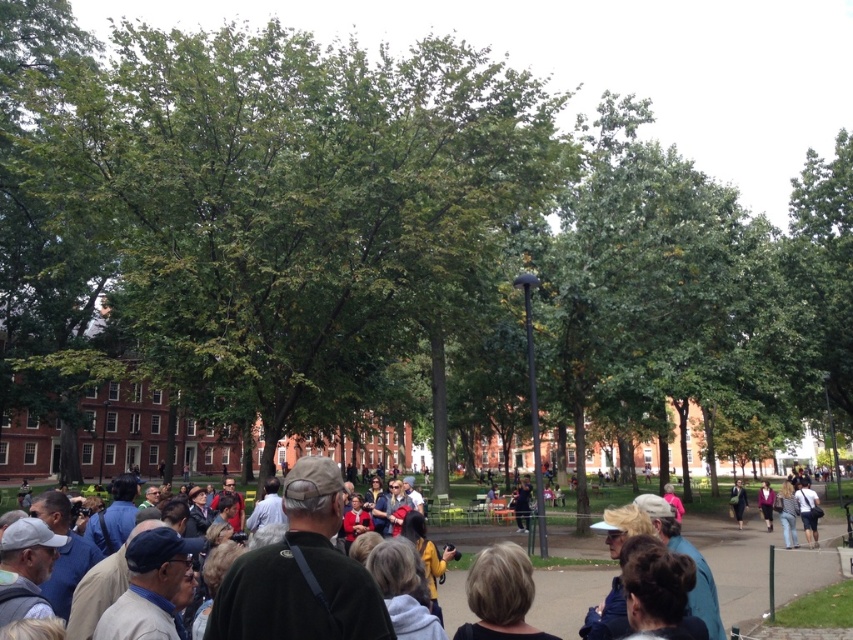
You are a photographer trying to capture a candid shot of the crowd. You notice a person with blonde hair at center and another wearing a dark blue jacket at center. Which of these two subjects is closer to the camera based on their positions?

The blonde hair at center is positioned over the dark blue jacket at center, meaning it is closer to the camera.

You are a photographer trying to capture a candid shot of the dark purple sweater at center without including the jeans at right in the frame. Given their sizes, is this possible?

The jeans at right is larger in size than the dark purple sweater at center, so it might be challenging to exclude the jeans at right from the frame if they are positioned close to the sweater. Adjust your angle or zoom to focus solely on the smaller dark purple sweater at center.